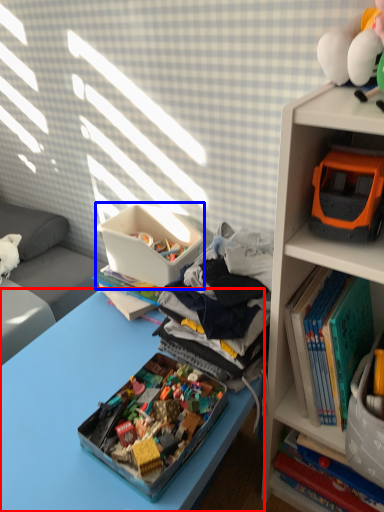
Question: Which object is further to the camera taking this photo, desk (highlighted by a red box) or storage box (highlighted by a blue box)?

Choices:
 (A) desk
 (B) storage box

Answer: (B)